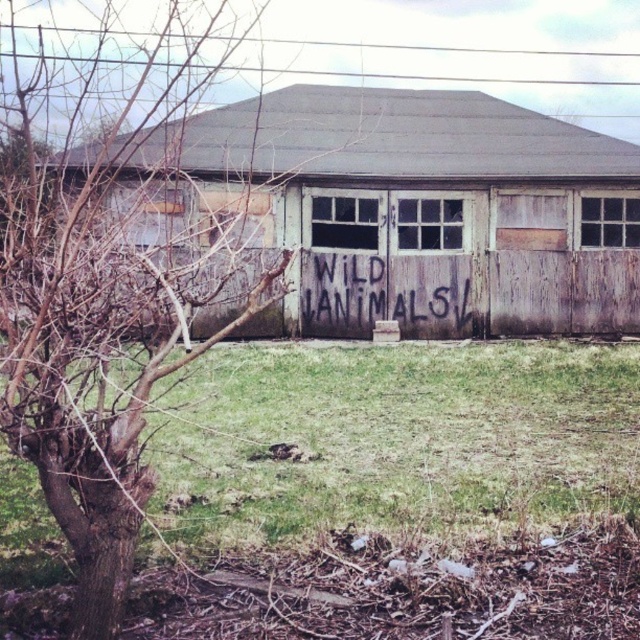
You are a hiker who has stumbled upon this abandoned area. You need to locate the weathered wood shed at center and the bare wood tree at left. Based on the scene, which object is positioned more to the east?

The weathered wood shed at center is to the right of the bare wood tree at left, so the shed is positioned more to the east if the tree is on the left side of the scene.

You are standing in front of the abandoned building and want to place a small flag at each of the two points labeled point (292, 157) and point (544, 419). Which point is closer to you so that the flag will be more visible?

Point (292, 157) is further to the camera than point (544, 419), so the flag placed at point (544, 419) will be closer to you and more visible.

You are a hiker lost in the woods and need to find shelter. You see a weathered wood shed at center and a bare wood tree at left. Which structure is closer to the ground?

The weathered wood shed at center is below the bare wood tree at left, so the shed is closer to the ground.